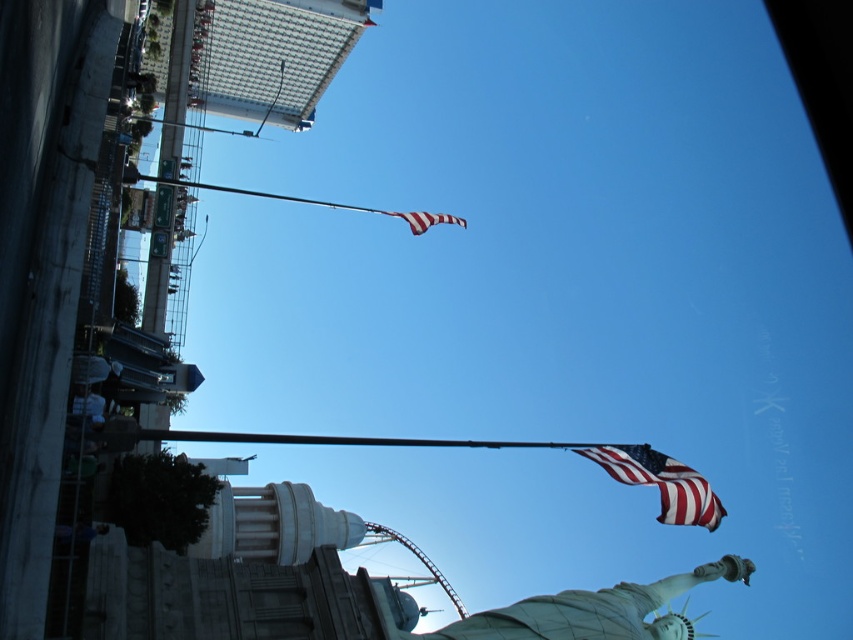
Does shiny silver statue at lower center appear over american flag at center?

No, shiny silver statue at lower center is not above american flag at center.

Is point (585, 604) in front of point (635, 465)?

That is True.

Measure the distance between point (x=514, y=634) and camera.

70.52 meters

Where is `shiny silver statue at lower center`? This screenshot has width=853, height=640. shiny silver statue at lower center is located at coordinates (584, 611).

Is shiny silver statue at lower center wider than american flag at upper center?

Correct, the width of shiny silver statue at lower center exceeds that of american flag at upper center.

This screenshot has width=853, height=640. Identify the location of shiny silver statue at lower center. (584, 611).

Is american flag at center to the left of polished metal flag pole at upper center from the viewer's perspective?

In fact, american flag at center is to the right of polished metal flag pole at upper center.

Which is behind, point (689, 509) or point (192, 186)?

The point (192, 186) is behind.

Where is `american flag at center`? The image size is (853, 640). american flag at center is located at coordinates (660, 483).